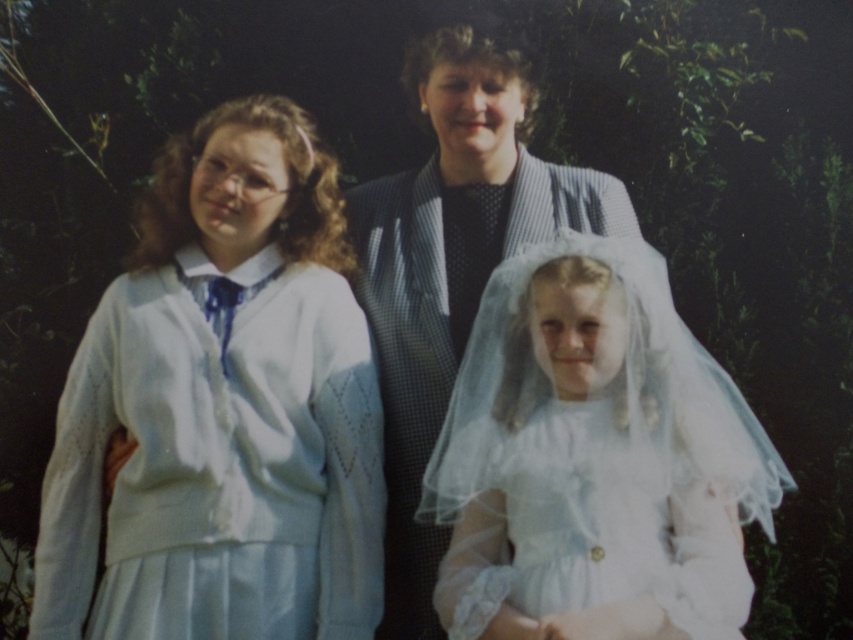
You are a photographer trying to adjust the lighting for a group photo. You notice two dresses in the scene. Which dress should you focus on to ensure it appears brighter in the final photo, the white knitted dress at left or the white satin dress at center?

The white knitted dress at left is located above the white satin dress at center, so focusing on the white knitted dress at left would ensure it appears brighter as it is positioned higher in the frame where lighting might be better.

You are a photographer holding a camera. You want to capture a clear photo of the white knitted dress at left without moving the dress. Can you do so while staying in your current position?

The white knitted dress at left and camera are 7.91 feet apart from each other. Since the distance is sufficient for a clear photo, yes, you can capture a clear photo of the white knitted dress at left without moving the dress while staying in your current position.